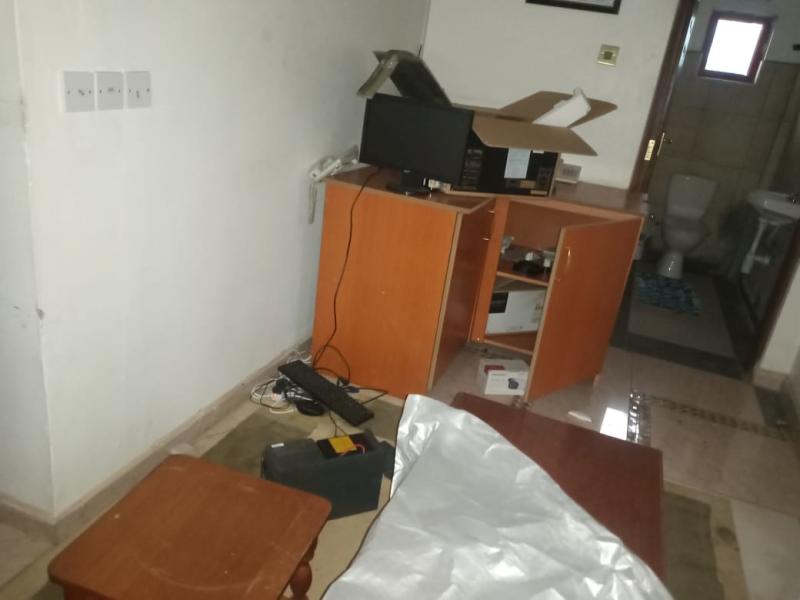
The height and width of the screenshot is (600, 800). What are the coordinates of `keyboard` in the screenshot? It's located at (328, 399).